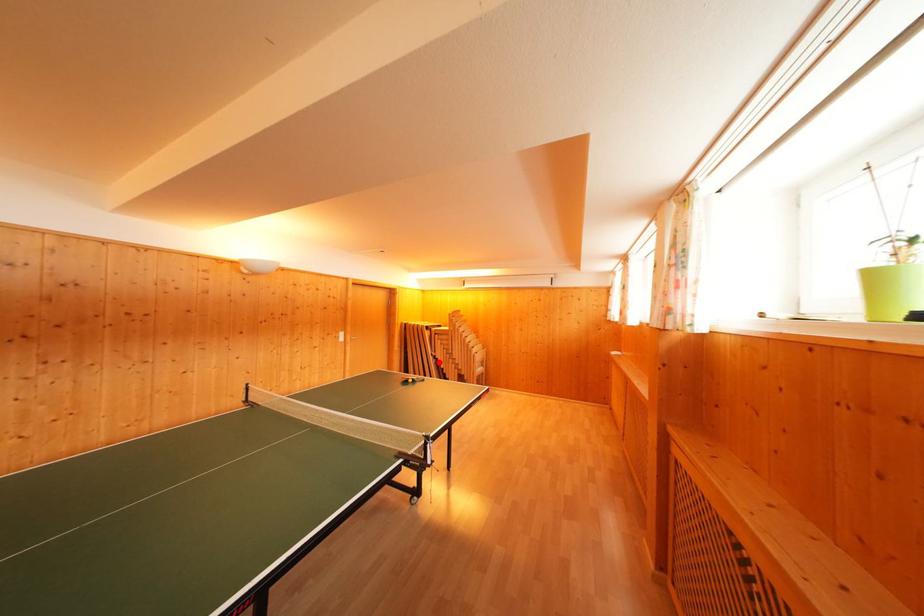
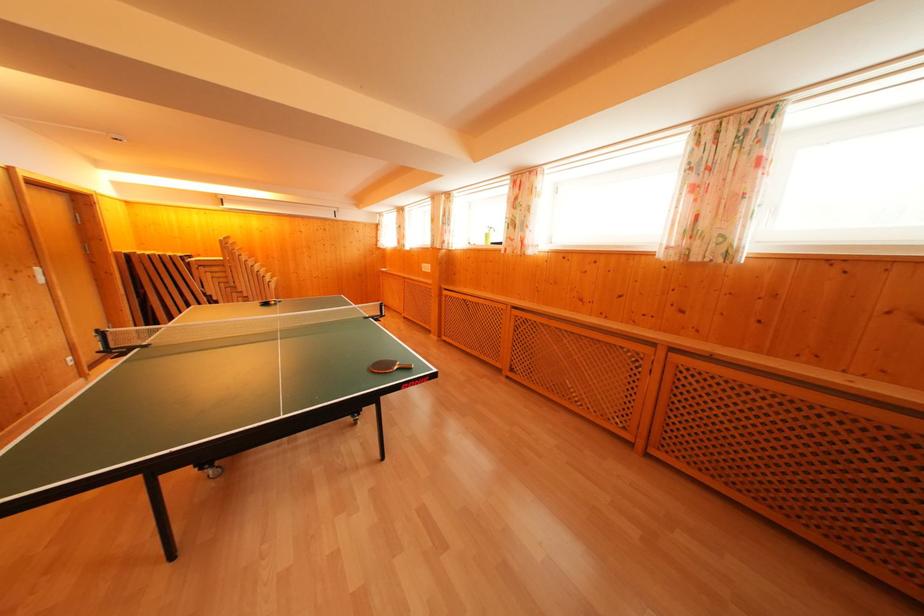
Question: A red point is marked in image1. In image2, is the corresponding 3D point closer to the camera or farther? Reply with the corresponding letter.

Choices:
 (A) The corresponding 3D point is closer.
 (B) The corresponding 3D point is farther.

Answer: (A)